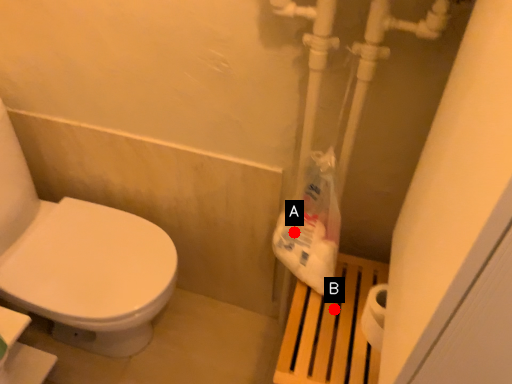
Question: Two points are circled on the image, labeled by A and B beside each circle. Among these points, which one is nearest to the camera?

Choices:
 (A) A is closer
 (B) B is closer

Answer: (B)